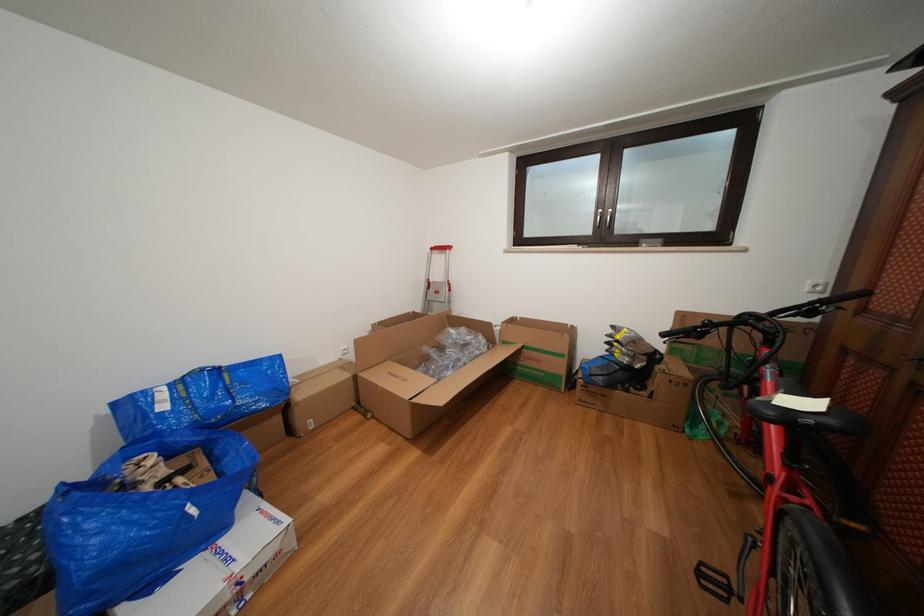
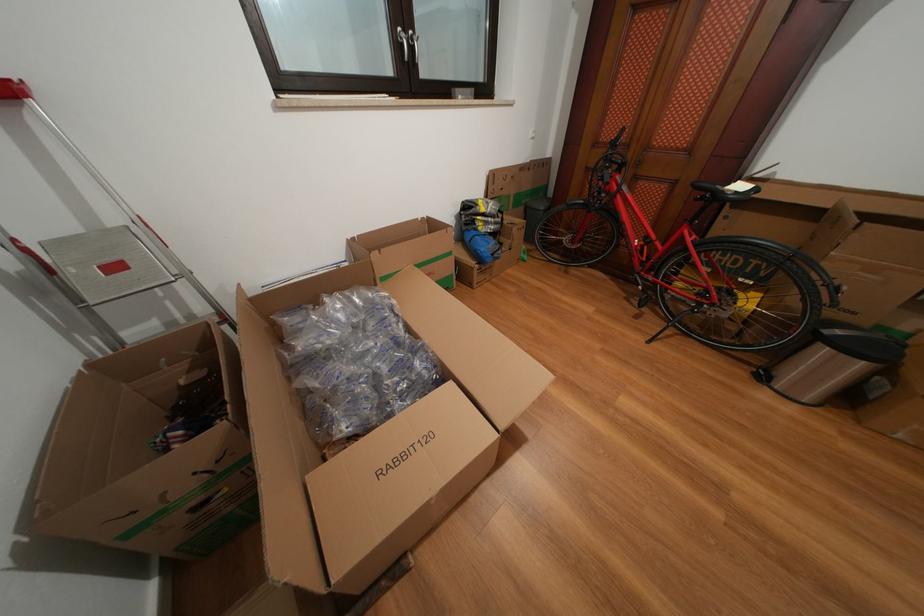
Where in the second image is the point corresponding to (x=626, y=342) from the first image?

(491, 215)